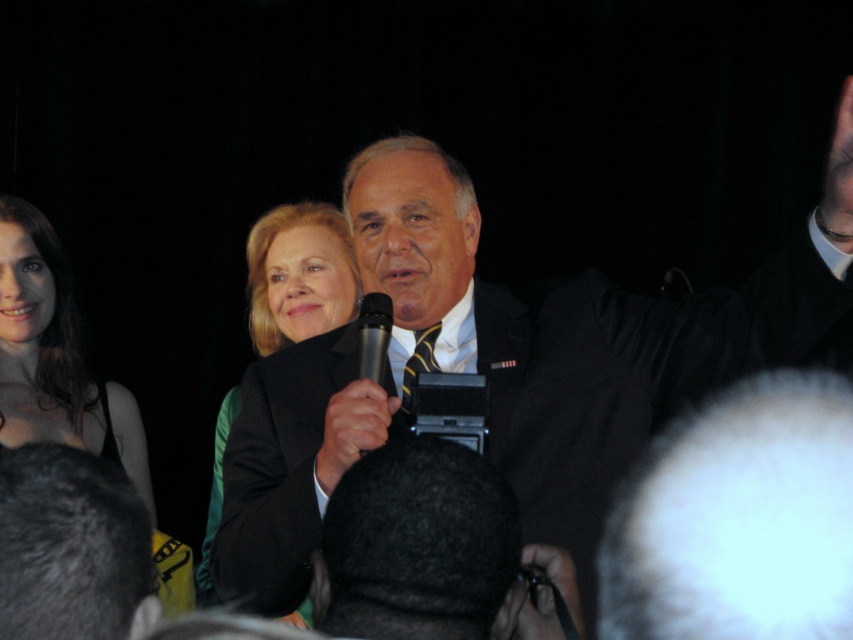
You are a photographer at this event and need to frame a closeup shot of both the black suit at center and the matte black dress at left. Based on their positions, which one should you adjust your camera angle to focus on first to ensure both are in the frame?

The black suit at center is wider than the matte black dress at left, so you should focus on the black suit at center first to accommodate its larger width in the frame.

You are a photographer at the event and need to adjust the lighting so that both the black suit at center and the matte black dress at left are equally visible. Considering their positions, which one might require more light adjustment to ensure visibility?

The black suit at center is taller than the matte black dress at left, so it might require more light adjustment to ensure visibility since it is larger in the frame.